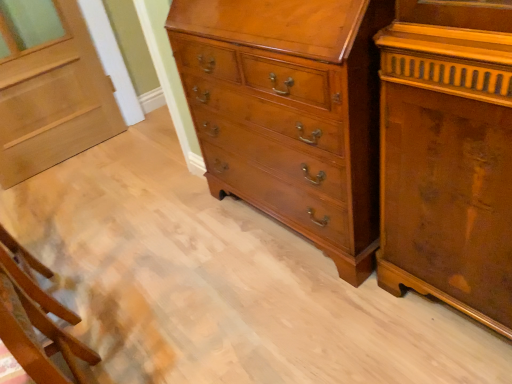
Question: Can we say light brown wood door at upper left lies outside wooden chair at lower left?

Choices:
 (A) yes
 (B) no

Answer: (A)

Question: Are light brown wood door at upper left and wooden chair at lower left beside each other?

Choices:
 (A) no
 (B) yes

Answer: (A)

Question: From a real-world perspective, is light brown wood door at upper left located beneath wooden chair at lower left?

Choices:
 (A) no
 (B) yes

Answer: (A)

Question: Is light brown wood door at upper left at the left side of wooden chair at lower left?

Choices:
 (A) yes
 (B) no

Answer: (A)

Question: Can you confirm if light brown wood door at upper left is bigger than wooden chair at lower left?

Choices:
 (A) yes
 (B) no

Answer: (B)

Question: Is light brown wood door at upper left smaller than wooden chair at lower left?

Choices:
 (A) no
 (B) yes

Answer: (B)

Question: Is light brown wood door at upper left facing towards glossy wood chest of drawers at center?

Choices:
 (A) no
 (B) yes

Answer: (B)

Question: From the image's perspective, is light brown wood door at upper left over glossy wood chest of drawers at center?

Choices:
 (A) yes
 (B) no

Answer: (A)

Question: From the image's perspective, would you say light brown wood door at upper left is shown under glossy wood chest of drawers at center?

Choices:
 (A) no
 (B) yes

Answer: (A)

Question: Can you confirm if light brown wood door at upper left is wider than glossy wood chest of drawers at center?

Choices:
 (A) no
 (B) yes

Answer: (A)

Question: Considering the relative sizes of light brown wood door at upper left and glossy wood chest of drawers at center in the image provided, is light brown wood door at upper left smaller than glossy wood chest of drawers at center?

Choices:
 (A) no
 (B) yes

Answer: (B)

Question: Is light brown wood door at upper left bigger than glossy wood chest of drawers at center?

Choices:
 (A) yes
 (B) no

Answer: (B)

Question: From the image's perspective, is glossy wood chest of drawers at center beneath light brown wood door at upper left?

Choices:
 (A) yes
 (B) no

Answer: (A)